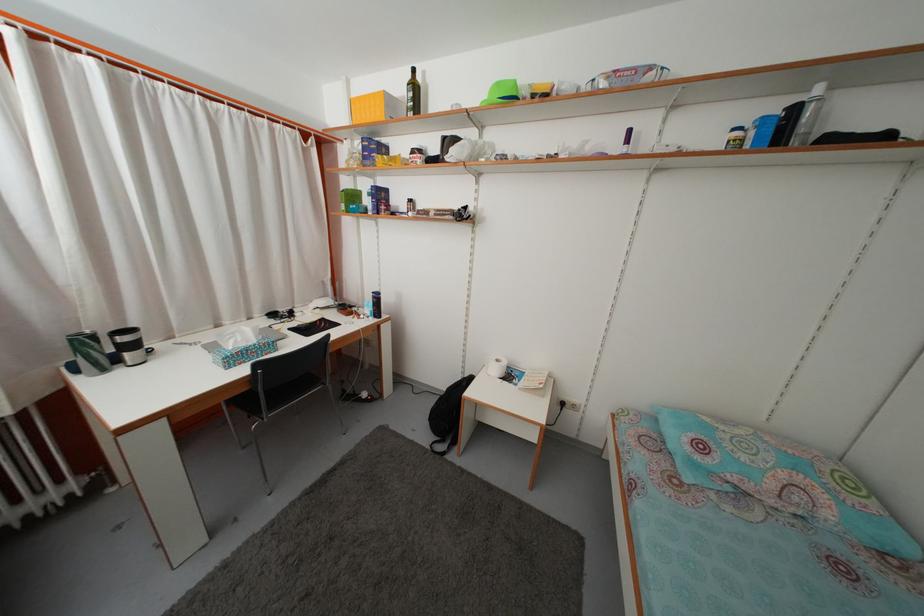
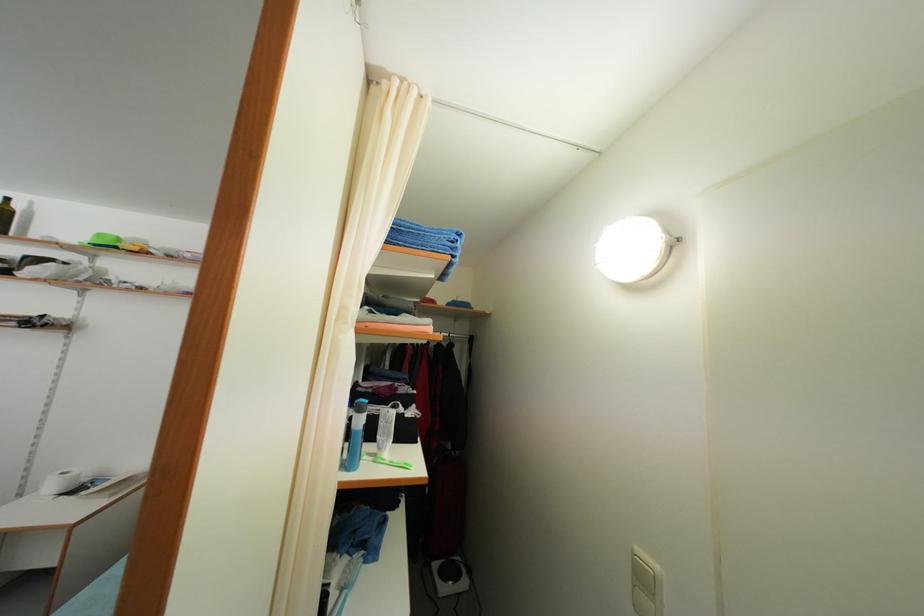
In the second image, find the point that corresponds to pixel 502 379 in the first image.

(56, 493)